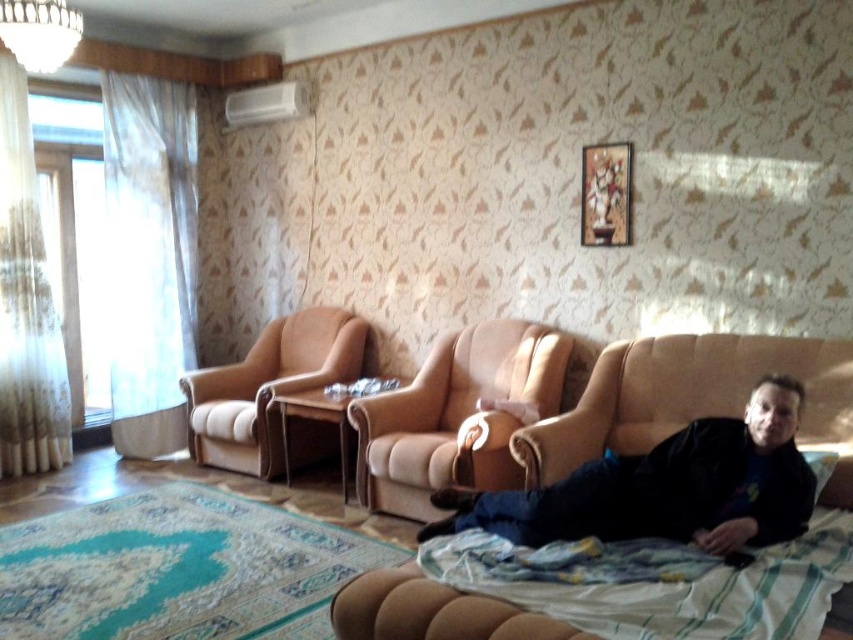
Which is in front, point (477, 410) or point (236, 369)?

Point (477, 410)

Is suede beige armchair at center positioned behind beige fabric armchair at center?

No, it is in front of beige fabric armchair at center.

The width and height of the screenshot is (853, 640). Find the location of `suede beige armchair at center`. suede beige armchair at center is located at coordinates (456, 417).

From the picture: Is black matte shirt at lower right to the right of beige fabric couch at lower right from the viewer's perspective?

In fact, black matte shirt at lower right is to the left of beige fabric couch at lower right.

Find the location of a particular element. The image size is (853, 640). black matte shirt at lower right is located at coordinates (666, 486).

The width and height of the screenshot is (853, 640). Find the location of `black matte shirt at lower right`. black matte shirt at lower right is located at coordinates (666, 486).

Can you confirm if black matte shirt at lower right is wider than blue striped fabric at lower right?

Incorrect, black matte shirt at lower right's width does not surpass blue striped fabric at lower right's.

Is black matte shirt at lower right thinner than blue striped fabric at lower right?

Yes, black matte shirt at lower right is thinner than blue striped fabric at lower right.

Is point (795, 401) positioned behind point (606, 589)?

Yes, point (795, 401) is behind point (606, 589).

The width and height of the screenshot is (853, 640). Identify the location of black matte shirt at lower right. 666,486.